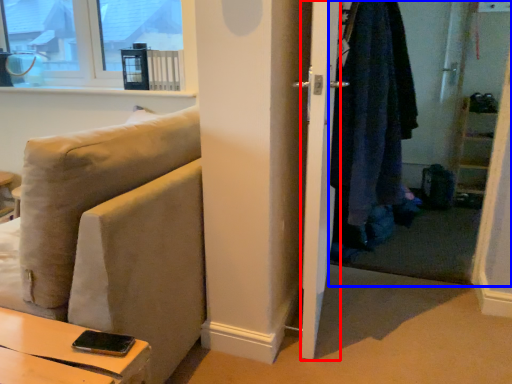
Question: Which object is closer to the camera taking this photo, screen door (highlighted by a red box) or closet (highlighted by a blue box)?

Choices:
 (A) screen door
 (B) closet

Answer: (A)